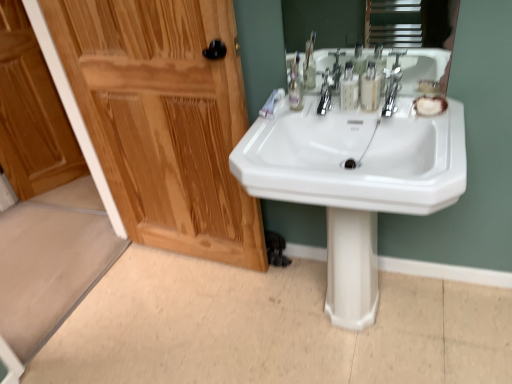
Question: Is chrome metallic faucet at upper center smaller than shiny wood door at left?

Choices:
 (A) yes
 (B) no

Answer: (A)

Question: Is chrome metallic faucet at upper center surrounding shiny wood door at left?

Choices:
 (A) yes
 (B) no

Answer: (B)

Question: Are chrome metallic faucet at upper center and shiny wood door at left making contact?

Choices:
 (A) no
 (B) yes

Answer: (A)

Question: Can you confirm if chrome metallic faucet at upper center is wider than shiny wood door at left?

Choices:
 (A) no
 (B) yes

Answer: (B)

Question: Are chrome metallic faucet at upper center and shiny wood door at left far apart?

Choices:
 (A) yes
 (B) no

Answer: (B)

Question: Considering the positions of translucent plastic mouthwash at center, which is the second mouthwash from left to right, and chrome metallic faucet at upper center in the image, is translucent plastic mouthwash at center, which is the second mouthwash from left to right, bigger or smaller than chrome metallic faucet at upper center?

Choices:
 (A) small
 (B) big

Answer: (A)

Question: Considering the positions of translucent plastic mouthwash at center, which is the second mouthwash from left to right, and chrome metallic faucet at upper center in the image, is translucent plastic mouthwash at center, which is the second mouthwash from left to right, taller or shorter than chrome metallic faucet at upper center?

Choices:
 (A) short
 (B) tall

Answer: (B)

Question: Does point (373, 64) appear closer or farther from the camera than point (387, 86)?

Choices:
 (A) farther
 (B) closer

Answer: (A)

Question: Considering the positions of translucent plastic mouthwash at center, which is the second mouthwash from left to right, and chrome metallic faucet at upper center in the image, is translucent plastic mouthwash at center, which is the second mouthwash from left to right, wider or thinner than chrome metallic faucet at upper center?

Choices:
 (A) thin
 (B) wide

Answer: (A)

Question: From a real-world perspective, is translucent plastic mouthwash at upper center, the 2th mouthwash viewed from the right, above or below chrome metallic faucet at upper center?

Choices:
 (A) above
 (B) below

Answer: (A)

Question: In terms of height, does translucent plastic mouthwash at upper center, the 2th mouthwash viewed from the right, look taller or shorter compared to chrome metallic faucet at upper center?

Choices:
 (A) short
 (B) tall

Answer: (B)

Question: Choose the correct answer: Is translucent plastic mouthwash at upper center, which is counted as the 1th mouthwash, starting from the left, inside chrome metallic faucet at upper center or outside it?

Choices:
 (A) outside
 (B) inside

Answer: (A)

Question: Is point (339, 82) closer or farther from the camera than point (394, 99)?

Choices:
 (A) closer
 (B) farther

Answer: (A)

Question: Would you say chrome metallic faucet at upper center is to the left or to the right of shiny wood door at left in the picture?

Choices:
 (A) right
 (B) left

Answer: (A)

Question: Considering the positions of chrome metallic faucet at upper center and shiny wood door at left in the image, is chrome metallic faucet at upper center taller or shorter than shiny wood door at left?

Choices:
 (A) tall
 (B) short

Answer: (B)